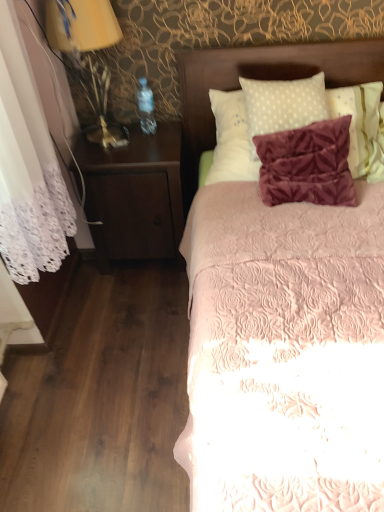
Question: Is matte gold lamp at left not within dark wood nightstand at left?

Choices:
 (A) yes
 (B) no

Answer: (A)

Question: Does matte gold lamp at left appear on the right side of dark wood nightstand at left?

Choices:
 (A) yes
 (B) no

Answer: (B)

Question: Can you confirm if matte gold lamp at left is shorter than dark wood nightstand at left?

Choices:
 (A) yes
 (B) no

Answer: (A)

Question: Does matte gold lamp at left have a greater height compared to dark wood nightstand at left?

Choices:
 (A) yes
 (B) no

Answer: (B)

Question: Is matte gold lamp at left looking in the opposite direction of dark wood nightstand at left?

Choices:
 (A) no
 (B) yes

Answer: (A)

Question: Considering the positions of point (109, 15) and point (307, 48), is point (109, 15) closer or farther from the camera than point (307, 48)?

Choices:
 (A) closer
 (B) farther

Answer: (A)

Question: Would you say matte gold lamp at left is to the left or to the right of pink quilted bed at center in the picture?

Choices:
 (A) right
 (B) left

Answer: (B)

Question: From the image's perspective, is matte gold lamp at left above or below pink quilted bed at center?

Choices:
 (A) above
 (B) below

Answer: (A)

Question: Is matte gold lamp at left wider or thinner than pink quilted bed at center?

Choices:
 (A) wide
 (B) thin

Answer: (B)

Question: In terms of height, does velvet brown headboard at upper center look taller or shorter compared to pink quilted bed at center?

Choices:
 (A) tall
 (B) short

Answer: (B)

Question: Considering the relative positions of velvet brown headboard at upper center and pink quilted bed at center in the image provided, is velvet brown headboard at upper center to the left or to the right of pink quilted bed at center?

Choices:
 (A) right
 (B) left

Answer: (B)

Question: Considering the positions of velvet brown headboard at upper center and pink quilted bed at center in the image, is velvet brown headboard at upper center wider or thinner than pink quilted bed at center?

Choices:
 (A) wide
 (B) thin

Answer: (B)

Question: Considering the positions of velvet brown headboard at upper center and pink quilted bed at center in the image, is velvet brown headboard at upper center bigger or smaller than pink quilted bed at center?

Choices:
 (A) small
 (B) big

Answer: (A)

Question: From a real-world perspective, is matte gold lamp at left positioned above or below velvet brown headboard at upper center?

Choices:
 (A) below
 (B) above

Answer: (B)

Question: Is matte gold lamp at left spatially inside velvet brown headboard at upper center, or outside of it?

Choices:
 (A) outside
 (B) inside

Answer: (A)